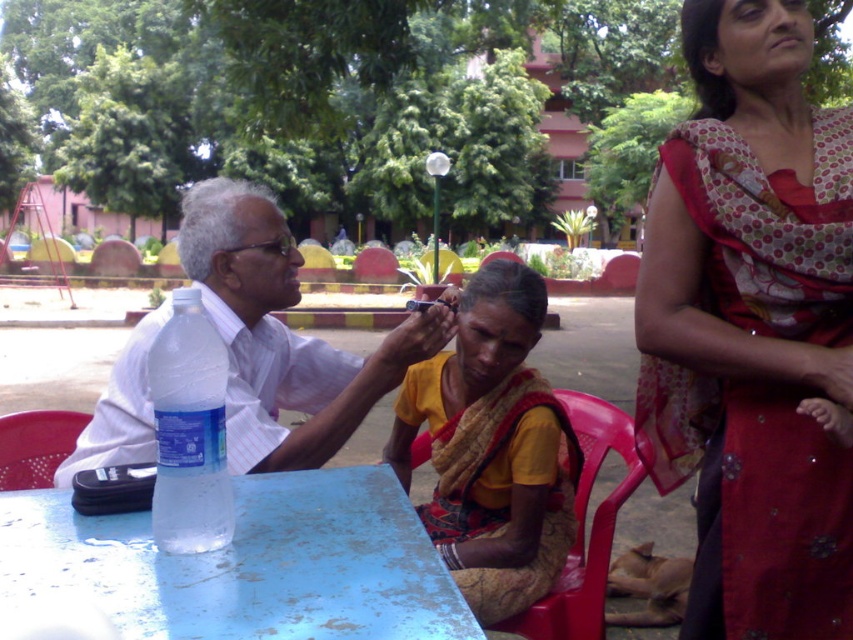
Consider the image. Does clear plastic bottle at table left have a smaller size compared to red plastic chair at lower center?

Correct, clear plastic bottle at table left occupies less space than red plastic chair at lower center.

Which is above, clear plastic bottle at table left or red plastic chair at lower center?

clear plastic bottle at table left

Where is `clear plastic bottle at table left`? The image size is (853, 640). clear plastic bottle at table left is located at coordinates (189, 429).

Is red floral sari at upper right thinner than plastic chair at lower left?

No, red floral sari at upper right is not thinner than plastic chair at lower left.

Does red floral sari at upper right appear under plastic chair at lower left?

No, red floral sari at upper right is not below plastic chair at lower left.

What are the coordinates of `red floral sari at upper right` in the screenshot? It's located at (752, 326).

Does clear plastic bottle at table left have a larger size compared to plastic chair at lower left?

Indeed, clear plastic bottle at table left has a larger size compared to plastic chair at lower left.

Which of these two, clear plastic bottle at table left or plastic chair at lower left, stands taller?

clear plastic bottle at table left

You are a GUI agent. You are given a task and a screenshot of the screen. Output one action in this format:
    pyautogui.click(x=<x>, y=<y>)
    Task: Click on the clear plastic bottle at table left
    Image resolution: width=853 pixels, height=640 pixels.
    Given the screenshot: What is the action you would take?
    point(189,429)